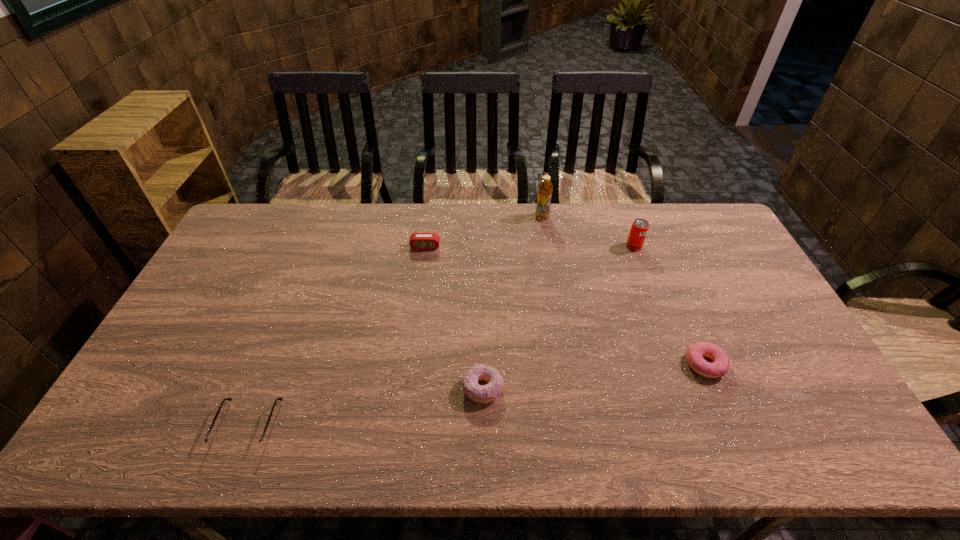
The width and height of the screenshot is (960, 540). I want to click on object that is the second closest one to the second tallest object, so click(721, 363).

Identify the location of object that is the fourth closest to the alarm clock. (639, 228).